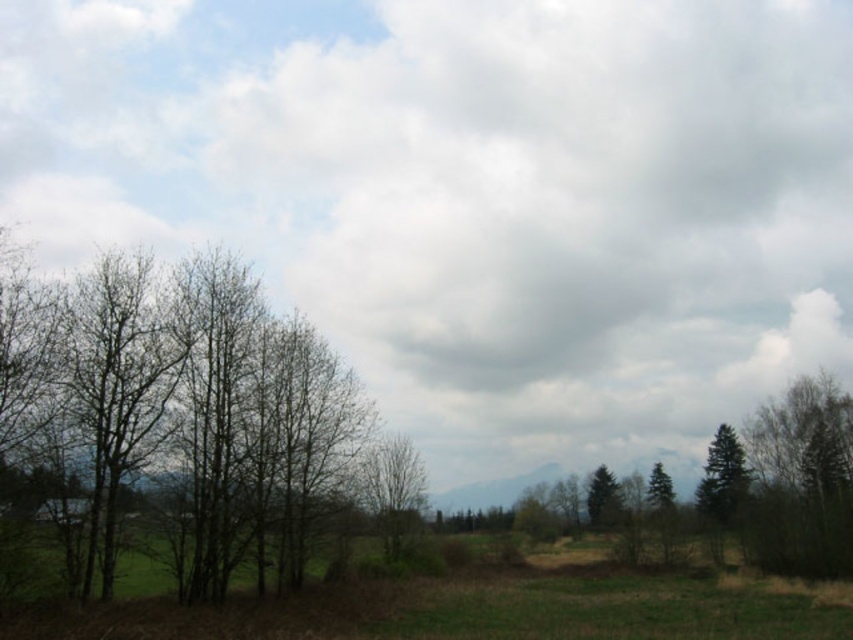
Can you confirm if green matte tree at right is positioned below green matte tree at center-right?

Actually, green matte tree at right is above green matte tree at center-right.

Does green matte tree at right have a greater height compared to green matte tree at center-right?

Correct, green matte tree at right is much taller as green matte tree at center-right.

Where is `green matte tree at right`? The height and width of the screenshot is (640, 853). green matte tree at right is located at coordinates (723, 477).

Is bare branches at left wider than smooth bark tree at center?

Yes, bare branches at left is wider than smooth bark tree at center.

Who is positioned more to the right, bare branches at left or smooth bark tree at center?

smooth bark tree at center

Find the location of a particular element. The height and width of the screenshot is (640, 853). bare branches at left is located at coordinates (181, 426).

How much distance is there between green grassy field at lower center and smooth bark tree at center?

green grassy field at lower center is 11.74 meters away from smooth bark tree at center.

Is green grassy field at lower center above smooth bark tree at center?

Actually, green grassy field at lower center is below smooth bark tree at center.

Image resolution: width=853 pixels, height=640 pixels. What do you see at coordinates (479, 609) in the screenshot? I see `green grassy field at lower center` at bounding box center [479, 609].

This screenshot has height=640, width=853. In order to click on green grassy field at lower center in this screenshot , I will do `click(479, 609)`.